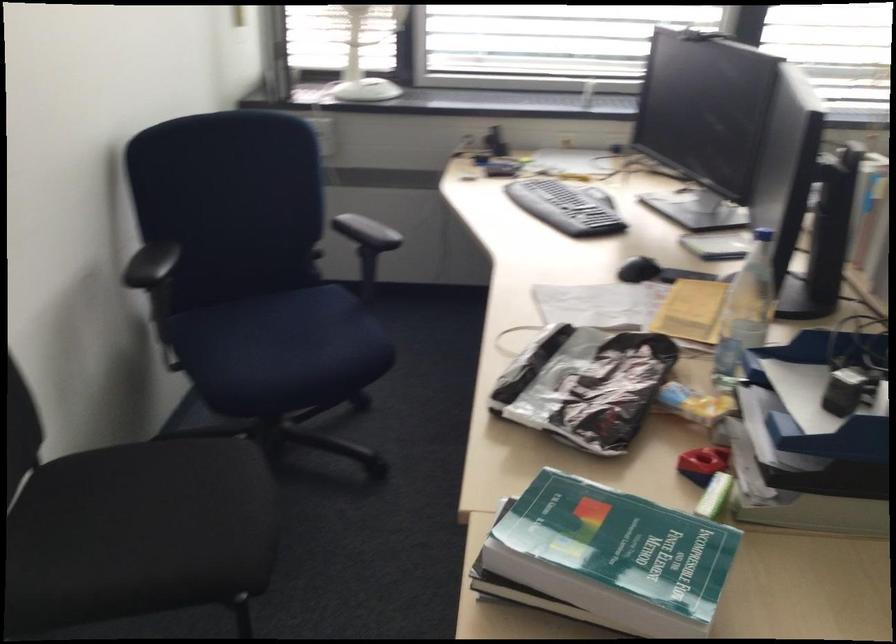
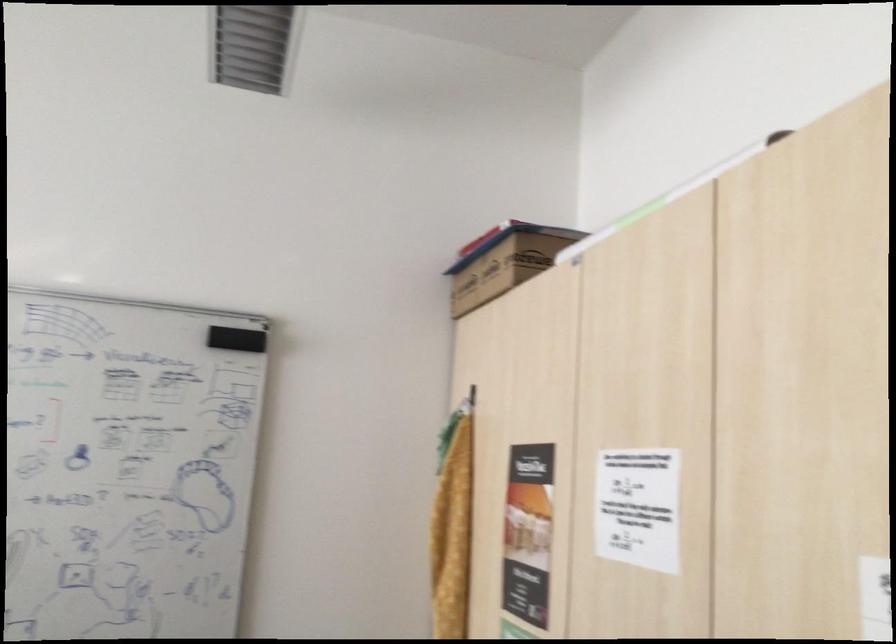
Question: Based on the continuous images, in which direction is the camera rotating? Reply with the corresponding letter.

Choices:
 (A) Left
 (B) Right
 (C) Up
 (D) Down

Answer: (B)